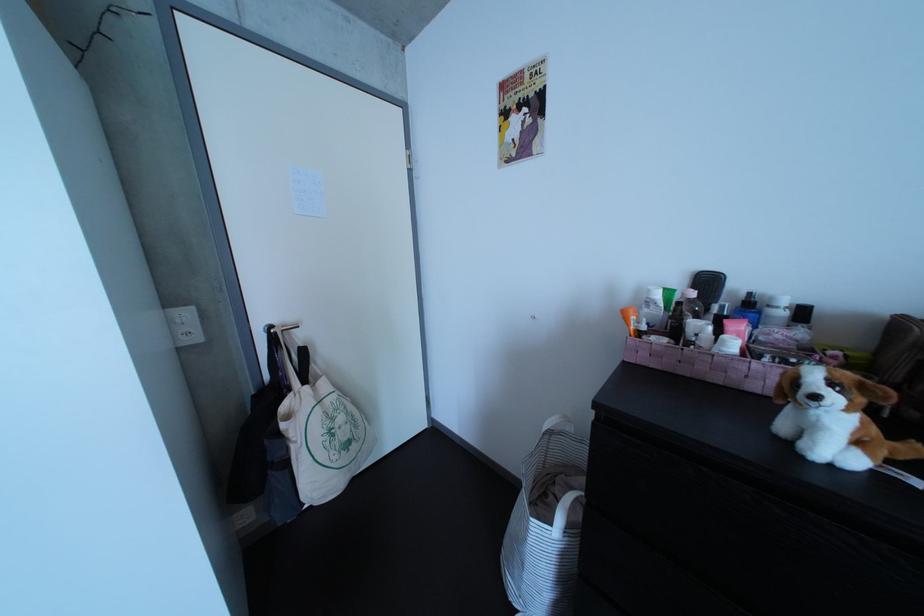
Find where to lift the orange cosmetic tube. Please return your answer as a coordinate pair (x, y).

(629, 320)